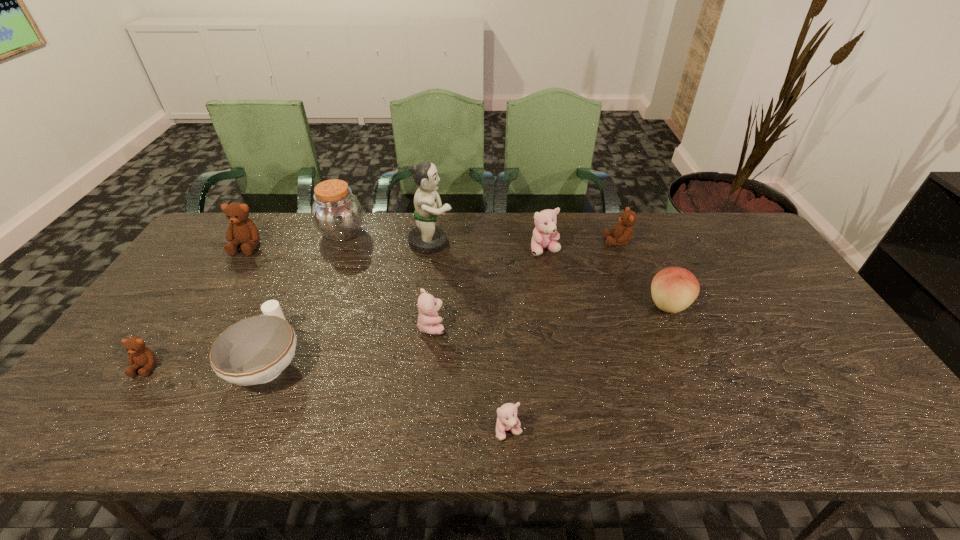
The height and width of the screenshot is (540, 960). I want to click on free space located on the face of the rightmost teddy bear, so click(559, 241).

In order to click on vacant space located on the face of the rightmost teddy bear in this screenshot , I will do `click(565, 241)`.

Locate an element on the screen. vacant space situated on the face of the rightmost teddy bear is located at coordinates (580, 241).

The width and height of the screenshot is (960, 540). Find the location of `vacant space positioned 0.220m at the face of the second smallest pink teddy bear`. vacant space positioned 0.220m at the face of the second smallest pink teddy bear is located at coordinates (527, 326).

The width and height of the screenshot is (960, 540). Find the location of `free space located 0.070m on the back of the peach`. free space located 0.070m on the back of the peach is located at coordinates (655, 273).

The width and height of the screenshot is (960, 540). Identify the location of free location located 0.280m on the side with the handle of the chinaware. (313, 260).

I want to click on free space located 0.190m on the side with the handle of the chinaware, so click(x=305, y=279).

Where is `free space located 0.400m on the side with the handle of the chinaware`? The height and width of the screenshot is (540, 960). free space located 0.400m on the side with the handle of the chinaware is located at coordinates (324, 237).

Where is `free space located on the face of the nearest brown teddy bear`? Image resolution: width=960 pixels, height=540 pixels. free space located on the face of the nearest brown teddy bear is located at coordinates (110, 419).

I want to click on figurine present at the far edge, so tap(425, 238).